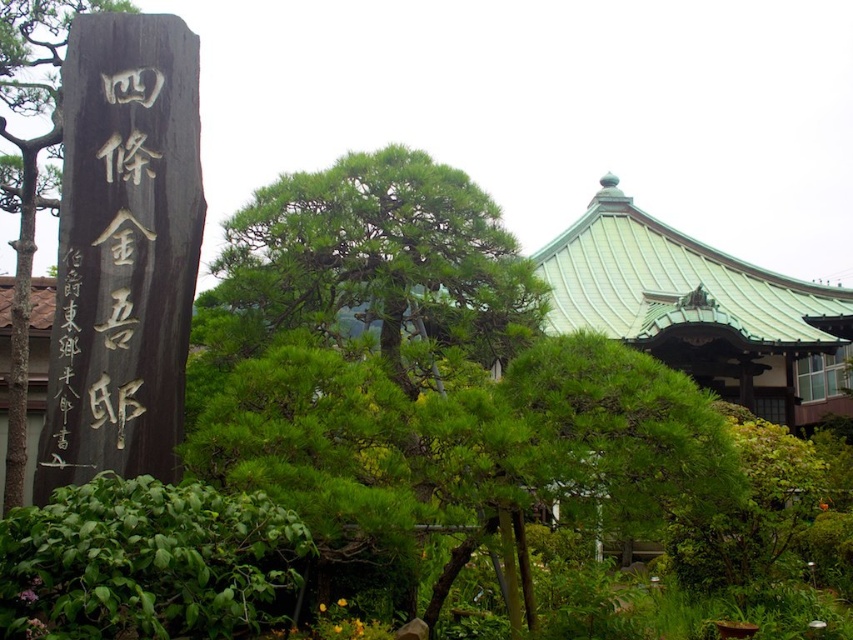
Question: Which point is closer to the camera taking this photo?

Choices:
 (A) (132, 308)
 (B) (15, 410)

Answer: (A)

Question: Does black wood sign at left appear on the right side of green leafy tree at left?

Choices:
 (A) yes
 (B) no

Answer: (A)

Question: Is black wood sign at left thinner than green leafy tree at left?

Choices:
 (A) no
 (B) yes

Answer: (B)

Question: Does black wood sign at left appear on the right side of green leafy tree at left?

Choices:
 (A) yes
 (B) no

Answer: (A)